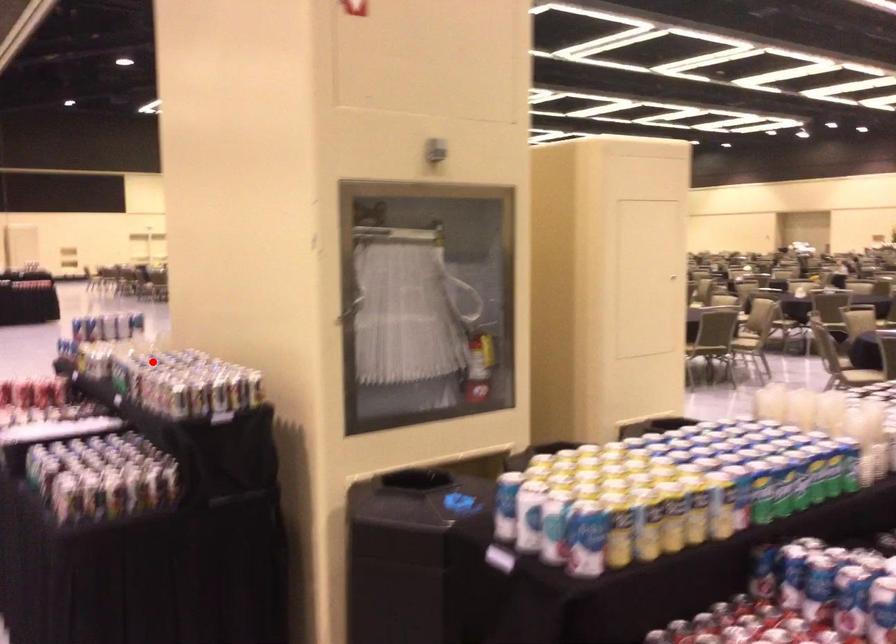
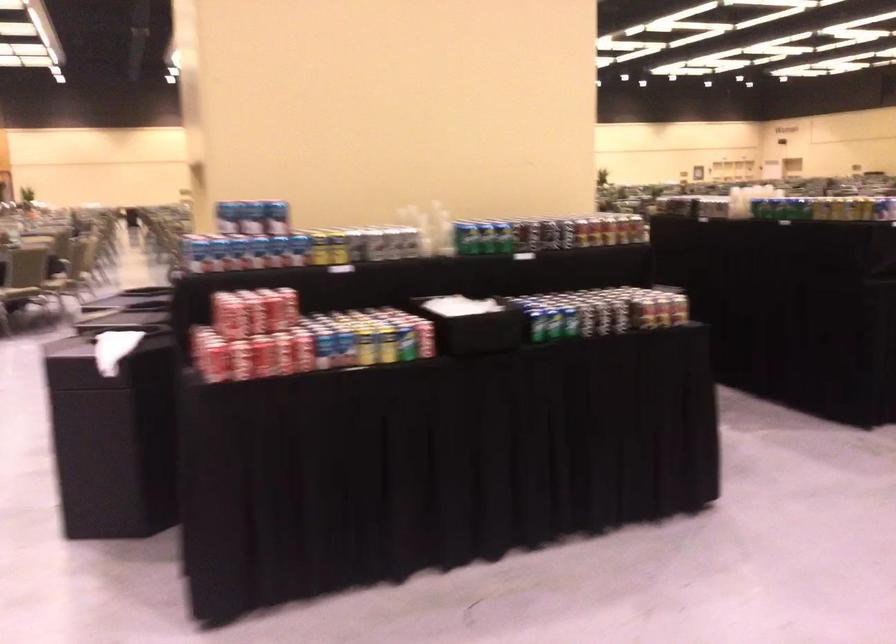
Find the pixel in the second image that matches the highlighted location in the first image.

(466, 238)